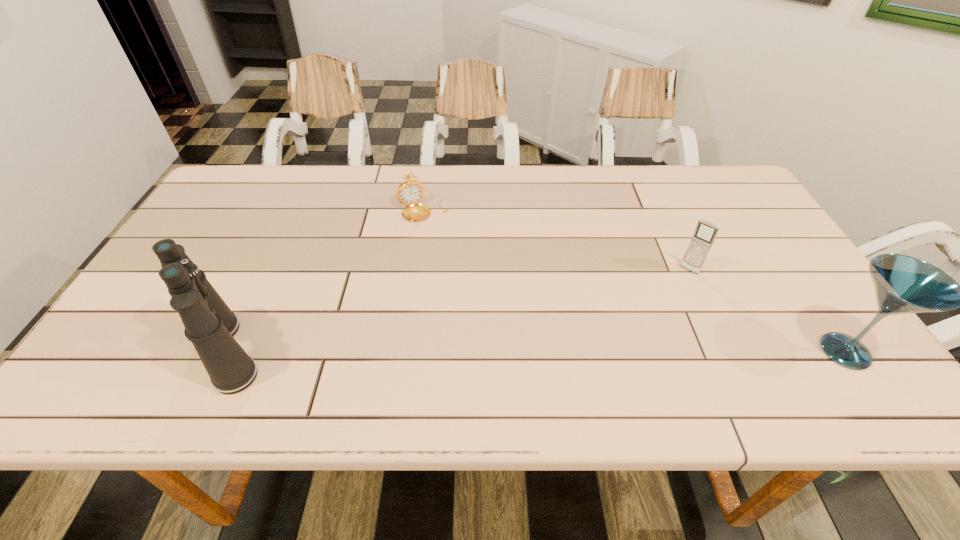
Where is `free space located on the front-facing side of the third object from left to right`? free space located on the front-facing side of the third object from left to right is located at coordinates (633, 341).

At what (x,y) coordinates should I click in order to perform the action: click on free space located 0.240m on the front-facing side of the third object from left to right. Please return your answer as a coordinate pair (x, y). Looking at the image, I should click on (639, 333).

Where is `free location located on the front-facing side of the third object from left to right`? The height and width of the screenshot is (540, 960). free location located on the front-facing side of the third object from left to right is located at coordinates (637, 335).

You are a GUI agent. You are given a task and a screenshot of the screen. Output one action in this format:
    pyautogui.click(x=<x>, y=<y>)
    Task: Click on the vacant space located on the face of the farthest object
    
    Given the screenshot: What is the action you would take?
    pyautogui.click(x=471, y=284)

This screenshot has width=960, height=540. I want to click on free space located 0.360m on the face of the farthest object, so click(487, 309).

I want to click on vacant area situated 0.110m on the face of the farthest object, so click(447, 245).

The height and width of the screenshot is (540, 960). I want to click on object that is positioned at the far edge, so click(410, 192).

At what (x,y) coordinates should I click in order to perform the action: click on binoculars that is at the near edge. Please return your answer as a coordinate pair (x, y). The height and width of the screenshot is (540, 960). Looking at the image, I should click on (210, 325).

This screenshot has height=540, width=960. What are the coordinates of `martini that is at the near edge` in the screenshot? It's located at (903, 284).

Locate an element on the screen. This screenshot has height=540, width=960. object present at the right edge is located at coordinates (903, 284).